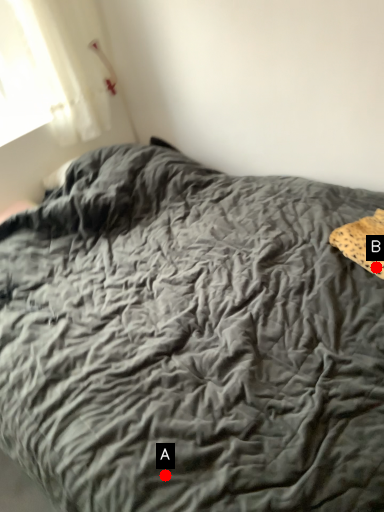
Question: Two points are circled on the image, labeled by A and B beside each circle. Which point is closer to the camera taking this photo?

Choices:
 (A) A is closer
 (B) B is closer

Answer: (A)